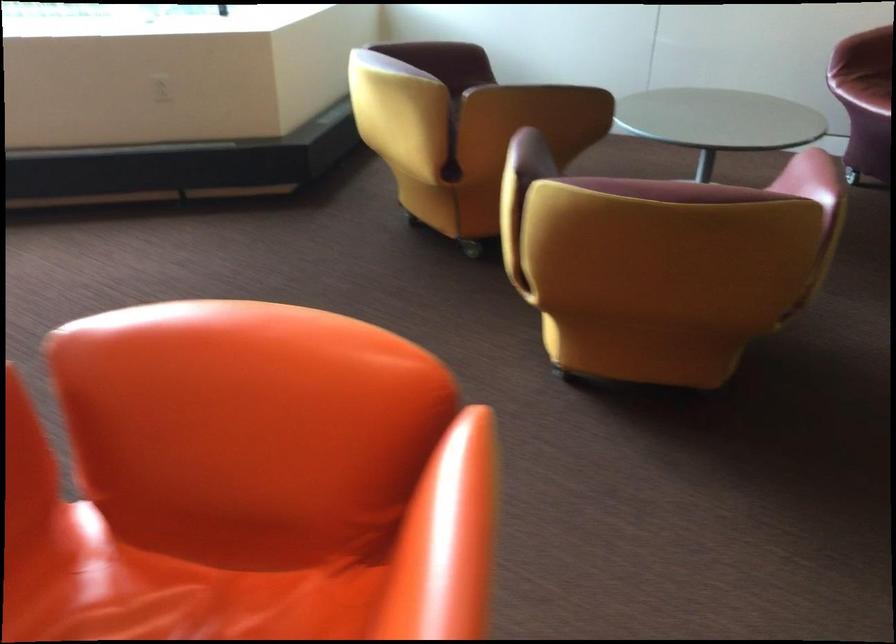
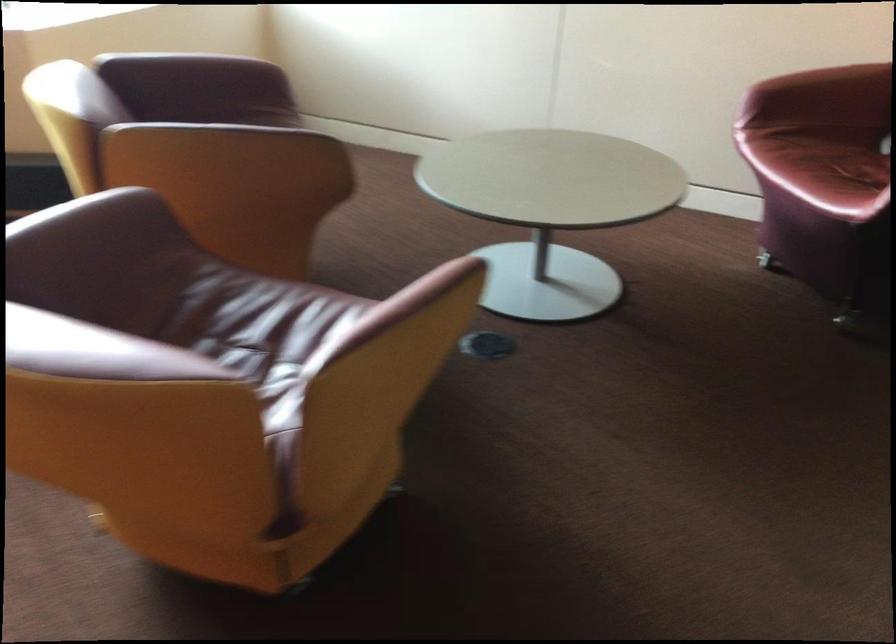
In a continuous first-person perspective shot, in which direction is the camera moving?

The cameraman walked toward right, forward.